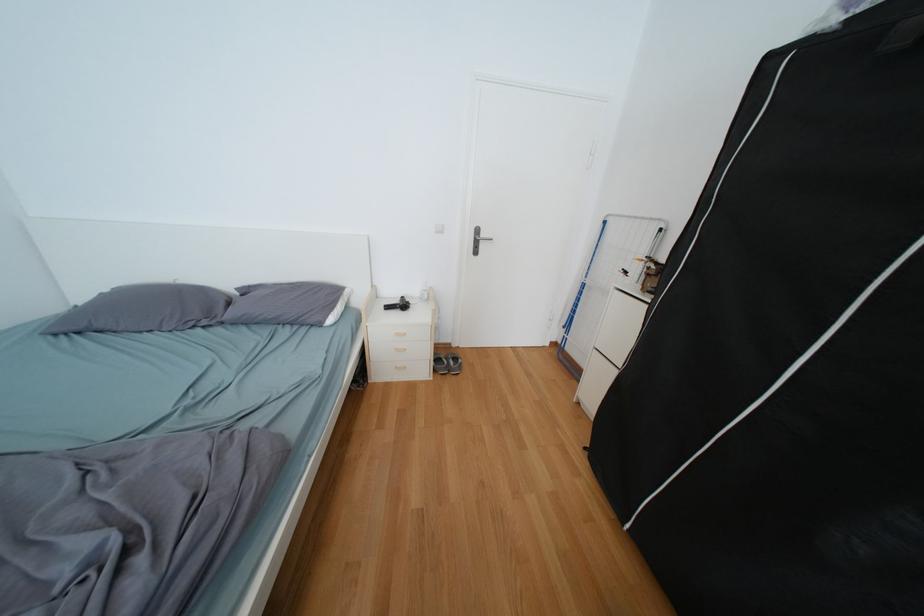
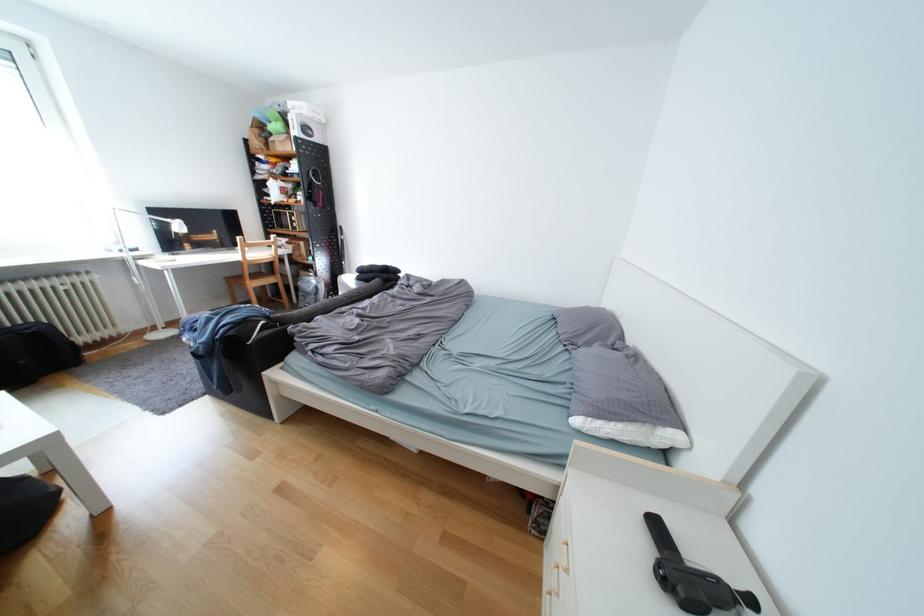
Find the pixel in the second image that matches point 343,321 in the first image.

(590, 422)